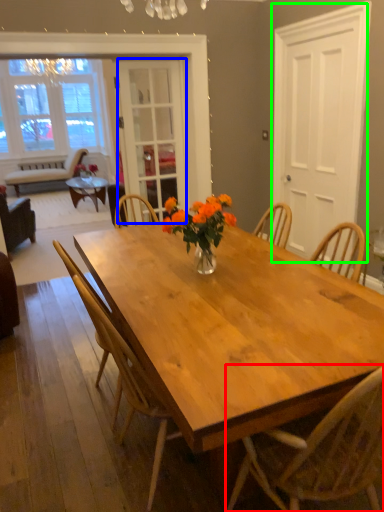
Question: Based on their relative distances, which object is nearer to chair (highlighted by a red box)? Choose from screen door (highlighted by a blue box) and screen door (highlighted by a green box).

Choices:
 (A) screen door
 (B) screen door

Answer: (B)